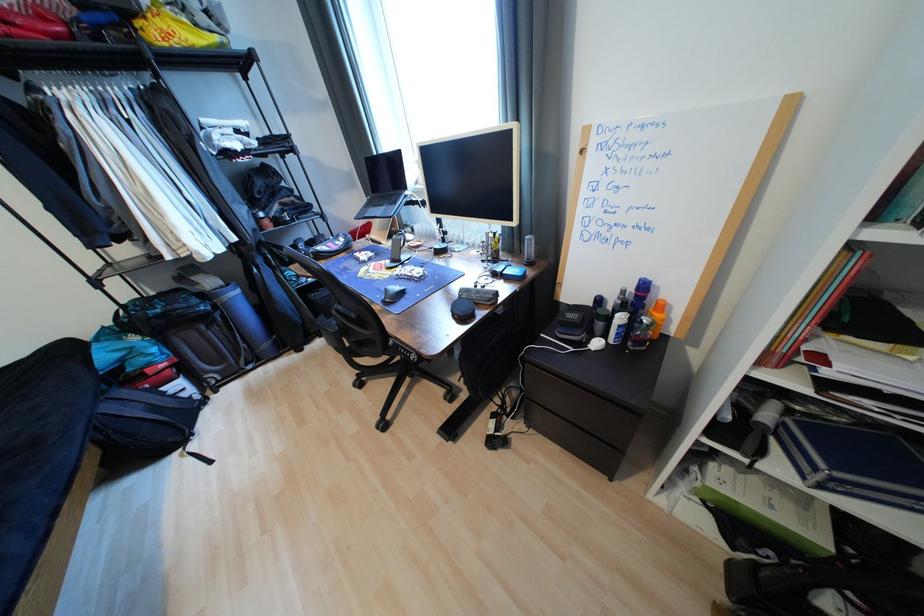
Where would you pull the top drawer pull? Please return your answer as a coordinate pair (x, y).

(581, 151)